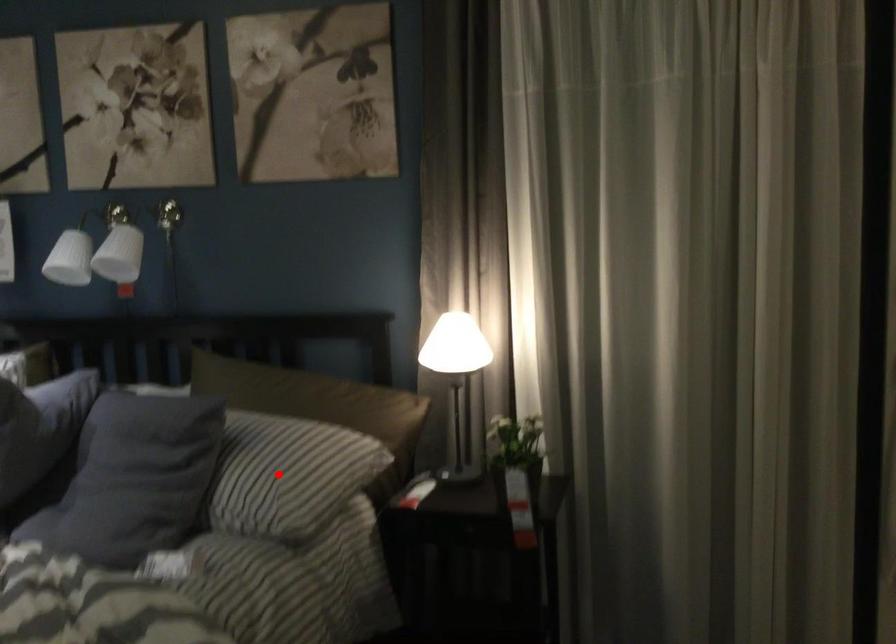
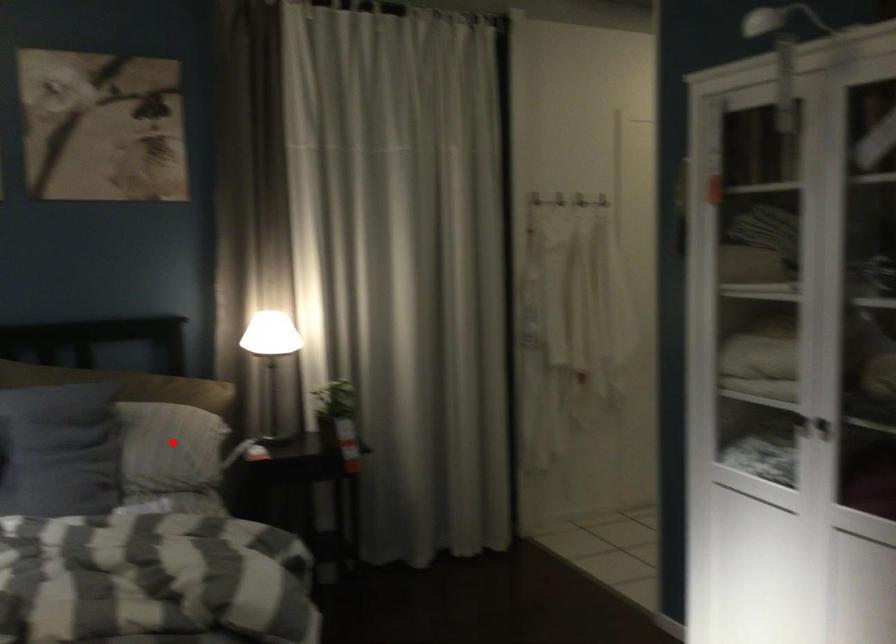
I am providing you with two images of the same scene from different viewpoints. A red point is marked on the first image and another point is marked on the second image. Is the red point in image1 aligned with the point shown in image2?

Yes